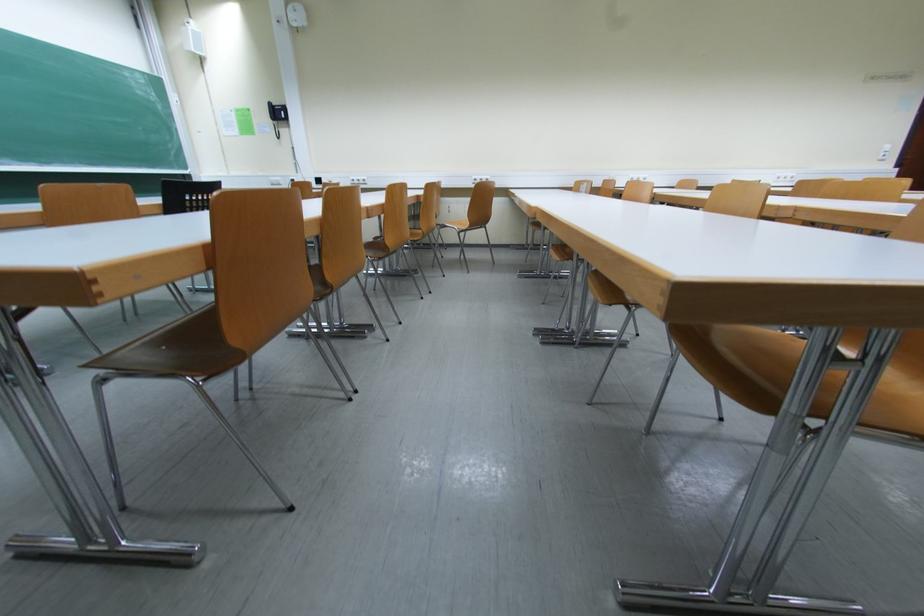
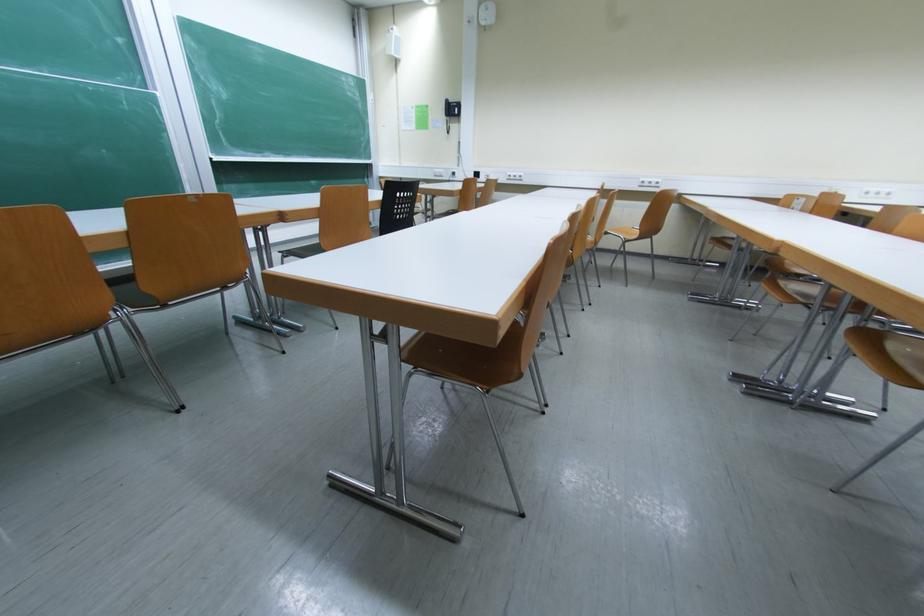
Question: The images are taken continuously from a first-person perspective. In which direction are you moving?

Choices:
 (A) Left
 (B) Right
 (C) Forward
 (D) Backward

Answer: (A)